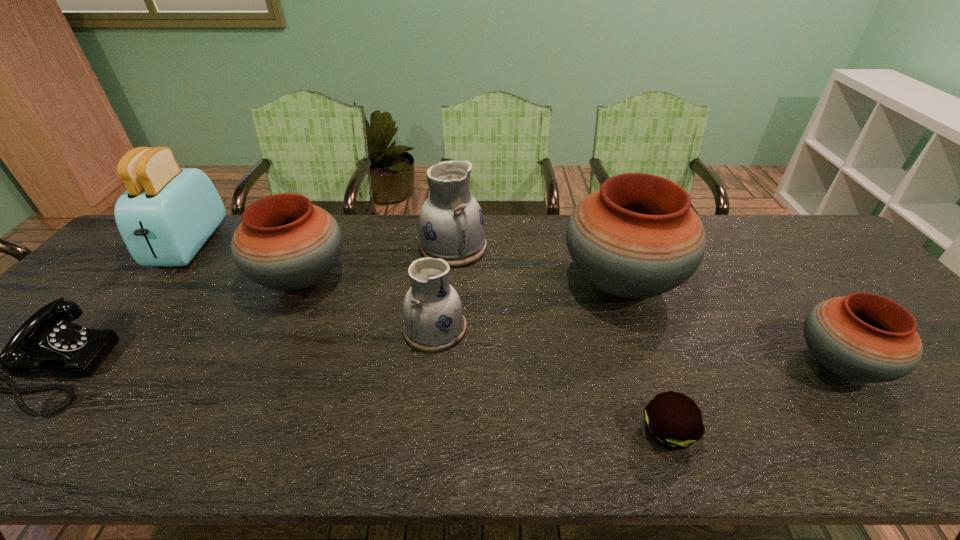
Image resolution: width=960 pixels, height=540 pixels. Identify the location of toaster. (167, 213).

You are a GUI agent. You are given a task and a screenshot of the screen. Output one action in this format:
    pyautogui.click(x=<x>, y=<y>)
    Task: Click on the biggest red pottery
    The width and height of the screenshot is (960, 540).
    Given the screenshot: What is the action you would take?
    pyautogui.click(x=637, y=236)

Locate an element on the screen. The height and width of the screenshot is (540, 960). the second pottery from right to left is located at coordinates (637, 236).

Locate an element on the screen. The width and height of the screenshot is (960, 540). the farther blue pottery is located at coordinates (451, 226).

Find the location of a particular element. The image size is (960, 540). the third object from left to right is located at coordinates (284, 242).

Where is `the leftmost pottery`? the leftmost pottery is located at coordinates (284, 242).

The image size is (960, 540). Find the location of `the nearer blue pottery`. the nearer blue pottery is located at coordinates (433, 317).

Identify the location of the rightmost pottery. (865, 337).

In order to click on the nearest red pottery in this screenshot , I will do `click(865, 337)`.

Where is `patty`? This screenshot has height=540, width=960. patty is located at coordinates (x=674, y=421).